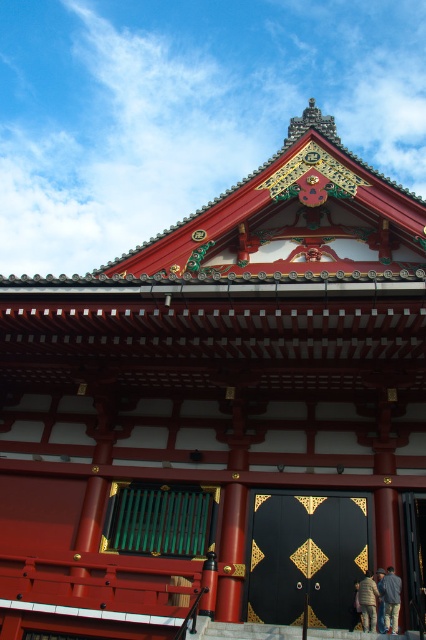
You are a visitor at the temple and want to enter through the black polished wood door at center. Before you approach the door, you notice the denim jacket at lower right. Where is the denim jacket located in relation to the door?

The denim jacket at lower right is behind the black polished wood door at center.

You are standing in front of the traditional Japanese temple and see both the denim jacket at lower right and the light brown leather jacket at lower right. Which jacket is closer to you?

The denim jacket at lower right is closer to you because it is in front of the light brown leather jacket at lower right.